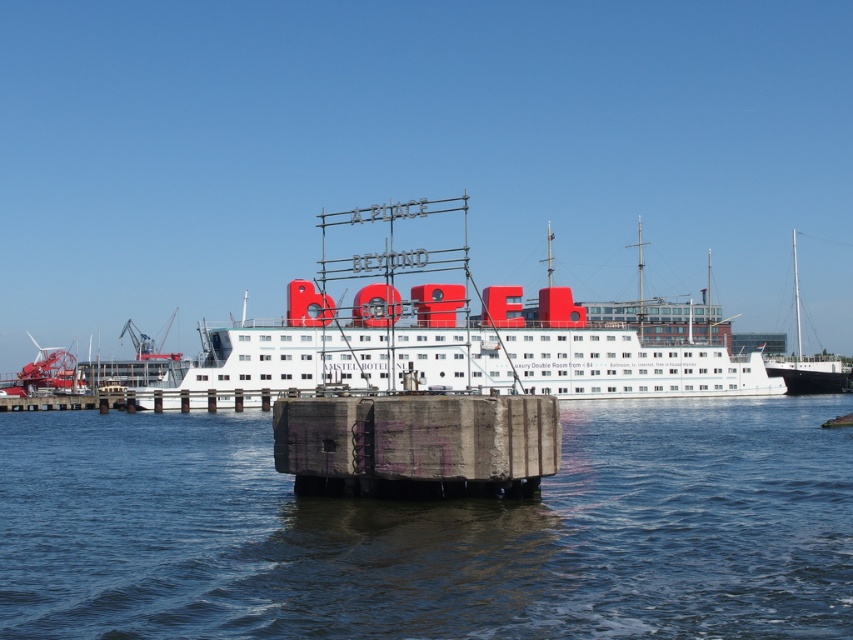
Question: Is transparent water at center wider than concrete dock at center?

Choices:
 (A) no
 (B) yes

Answer: (B)

Question: Considering the relative positions of transparent water at center and concrete dock at center in the image provided, where is transparent water at center located with respect to concrete dock at center?

Choices:
 (A) left
 (B) right

Answer: (A)

Question: Which of the following is the closest to the observer?

Choices:
 (A) white matte boat at center
 (B) black polished wood sailboat at right

Answer: (A)

Question: Is concrete dock at center further to camera compared to black polished wood sailboat at right?

Choices:
 (A) yes
 (B) no

Answer: (B)

Question: Which point is closer to the camera?

Choices:
 (A) black polished wood sailboat at right
 (B) concrete dock at center

Answer: (B)

Question: Considering the real-world distances, which object is farthest from the white matte boat at center?

Choices:
 (A) concrete dock at center
 (B) black polished wood sailboat at right

Answer: (B)